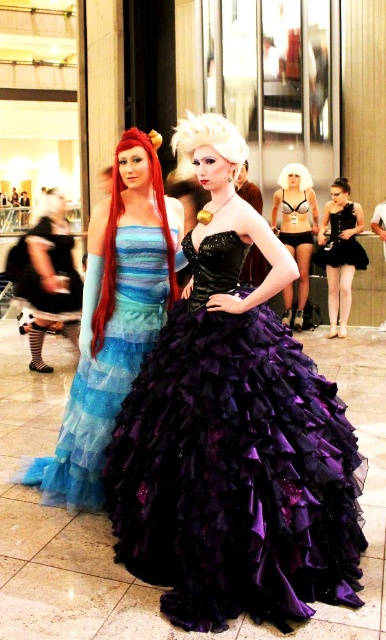
Question: Is shiny blue tulle dress at center further to camera compared to white matte wig at upper center?

Choices:
 (A) no
 (B) yes

Answer: (A)

Question: Which of these objects is positioned farthest from the white shiny wig at center?

Choices:
 (A) white matte wig at upper center
 (B) shiny purple gown at center
 (C) black satin dress at center

Answer: (A)

Question: Does shiny blue tulle dress at center appear on the left side of white shiny wig at center?

Choices:
 (A) no
 (B) yes

Answer: (B)

Question: Is shiny purple gown at center bigger than matte black bodysuit at center?

Choices:
 (A) yes
 (B) no

Answer: (A)

Question: Considering the real-world distances, which object is closest to the white matte wig at upper center?

Choices:
 (A) shiny purple gown at center
 (B) shiny red wig at left
 (C) matte black bra at center

Answer: (C)

Question: Which object is closer to the camera taking this photo?

Choices:
 (A) white shiny wig at center
 (B) shiny red wig at left
 (C) white matte wig at upper center

Answer: (A)